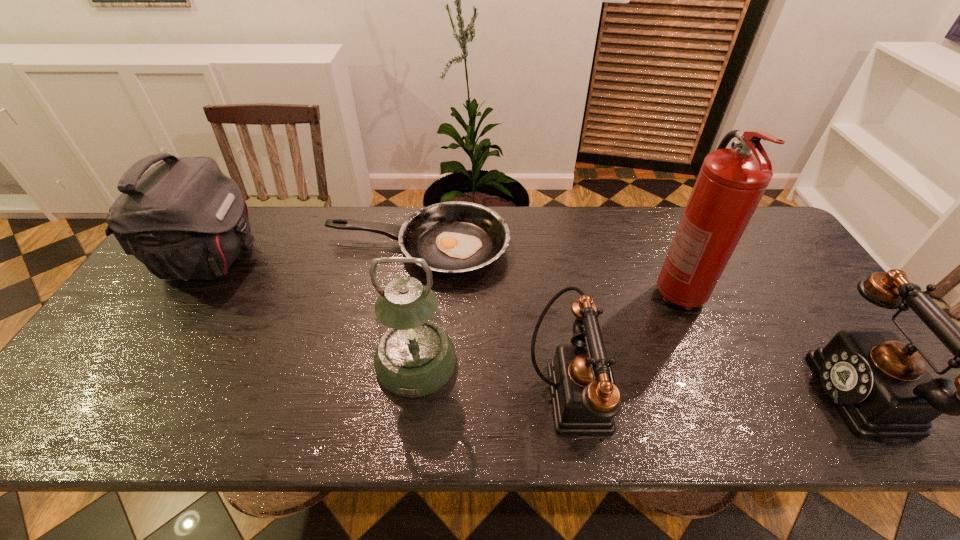
At what (x,y) coordinates should I click in order to perform the action: click on vacant space at the right edge. Please return your answer as a coordinate pair (x, y). The image size is (960, 540). Looking at the image, I should click on (755, 268).

The width and height of the screenshot is (960, 540). Find the location of `free region at the near left corner of the desktop`. free region at the near left corner of the desktop is located at coordinates (107, 371).

Where is `free point at the far right corner`? free point at the far right corner is located at coordinates (778, 248).

Identify the location of empty space between the lantern and the fire extinguisher. The image size is (960, 540). (547, 328).

Identify the location of free space between the second object from right to left and the shoulder bag. (445, 277).

At what (x,y) coordinates should I click in order to perform the action: click on free spot between the shortest object and the third object from right to left. Please return your answer as a coordinate pair (x, y). Looking at the image, I should click on (494, 320).

This screenshot has height=540, width=960. What are the coordinates of `vacant space that's between the shortest object and the fire extinguisher` in the screenshot? It's located at (548, 271).

Where is `empty location between the lantern and the shoulder bag`? The height and width of the screenshot is (540, 960). empty location between the lantern and the shoulder bag is located at coordinates [314, 311].

Identify the location of object that is the fourth closest to the leftmost object. (731, 182).

Locate which object is the fifth closest to the shoulder bag. Please provide its 2D coordinates. Your answer should be formatted as a tuple, i.e. [(x, y)], where the tuple contains the x and y coordinates of a point satisfying the conditions above.

[(880, 385)]